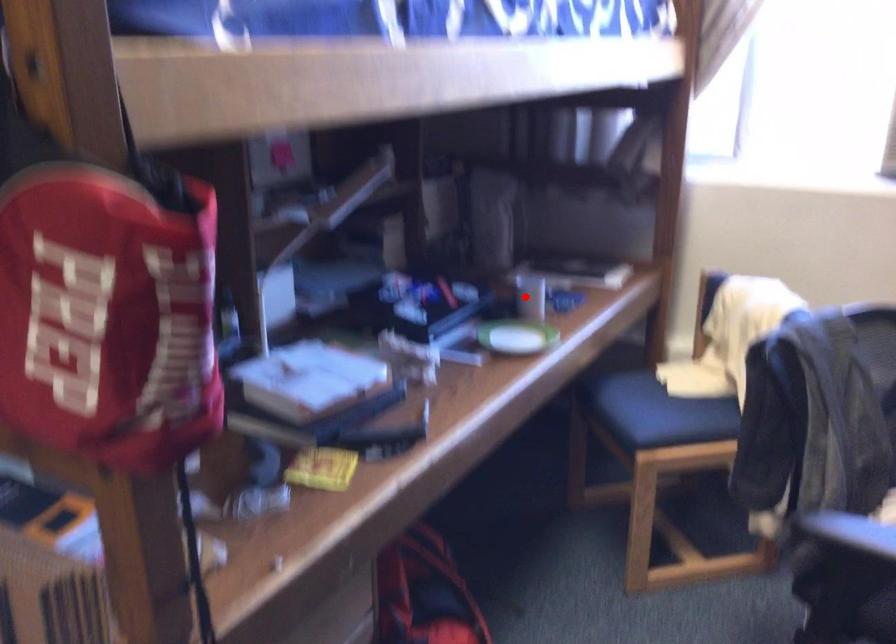
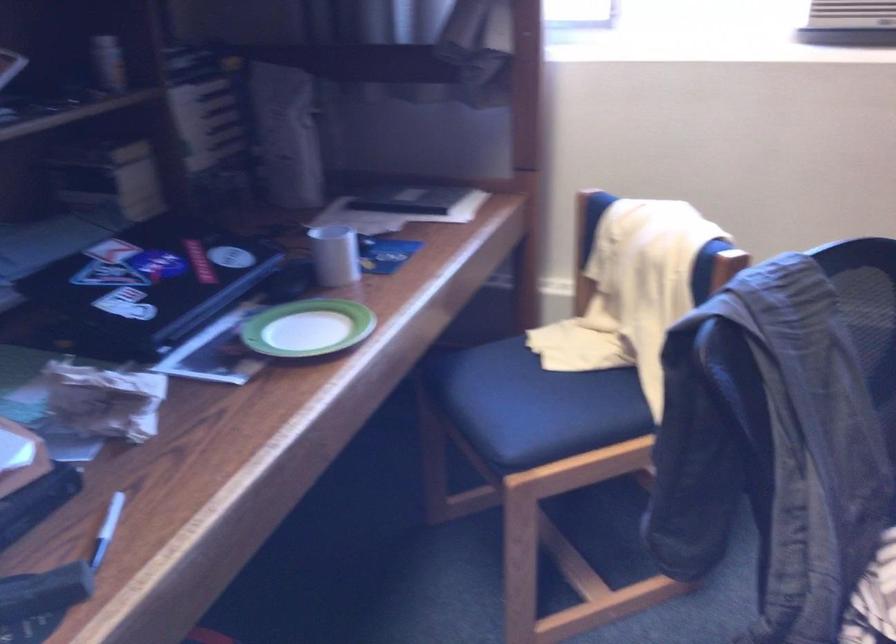
Question: I am providing you with two images of the same scene from different viewpoints. In image1, a red point is highlighted. Considering the same 3D point in image2, which of the following is correct?

Choices:
 (A) It is closer
 (B) It is farther

Answer: (A)